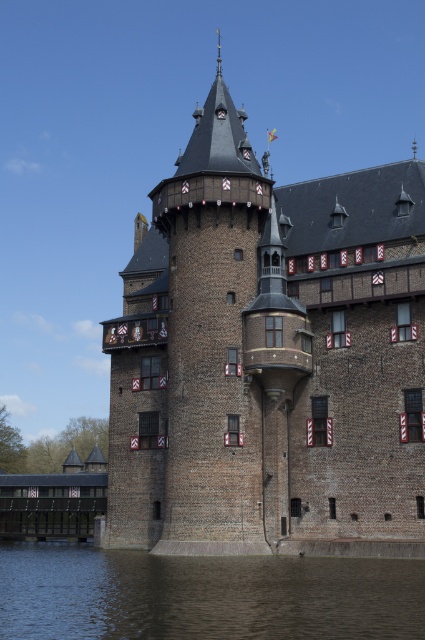
Question: Is brown brick castle at center wider than brown water at lower center?

Choices:
 (A) yes
 (B) no

Answer: (A)

Question: Which point appears farthest from the camera in this image?

Choices:
 (A) [305, 305]
 (B) [59, 630]

Answer: (A)

Question: Which point is farther from the camera taking this photo?

Choices:
 (A) (325, 433)
 (B) (147, 609)

Answer: (A)

Question: Can you confirm if brown brick castle at center is positioned above brown water at lower center?

Choices:
 (A) no
 (B) yes

Answer: (B)

Question: From the image, what is the correct spatial relationship of brown brick castle at center in relation to brown water at lower center?

Choices:
 (A) below
 (B) above

Answer: (B)